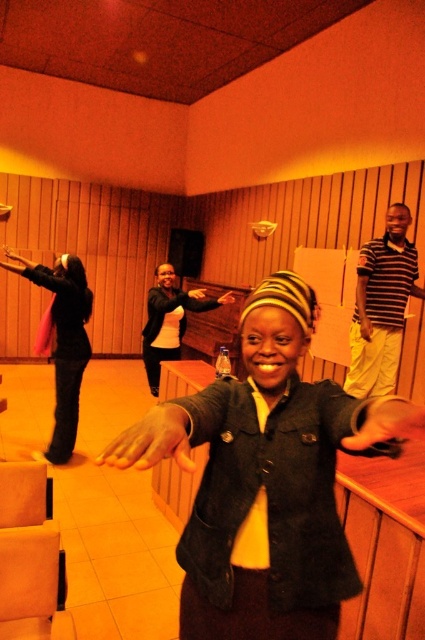
Is denim jacket at center below matte black jacket at left?

Indeed, denim jacket at center is positioned under matte black jacket at left.

Consider the image. Can you confirm if denim jacket at center is positioned to the right of matte black jacket at left?

Correct, you'll find denim jacket at center to the right of matte black jacket at left.

Measure the distance between denim jacket at center and camera.

denim jacket at center and camera are 26.93 inches apart from each other.

Locate an element on the screen. denim jacket at center is located at coordinates (266, 477).